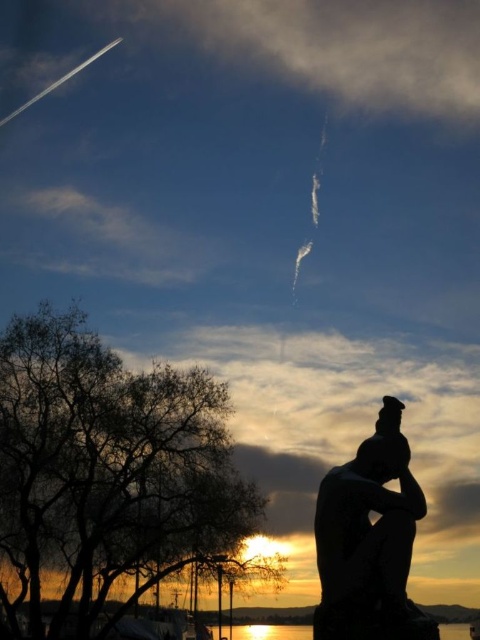
Question: Can you confirm if silhouette statue at lower right is positioned to the right of glistening water at lower center?

Choices:
 (A) yes
 (B) no

Answer: (B)

Question: Which point is farther to the camera?

Choices:
 (A) silhouette statue at lower right
 (B) glistening water at lower center

Answer: (B)

Question: Is silhouette statue at lower right bigger than glistening water at lower center?

Choices:
 (A) yes
 (B) no

Answer: (B)

Question: Is silhouette statue at lower right further to the viewer compared to glistening water at lower center?

Choices:
 (A) yes
 (B) no

Answer: (B)